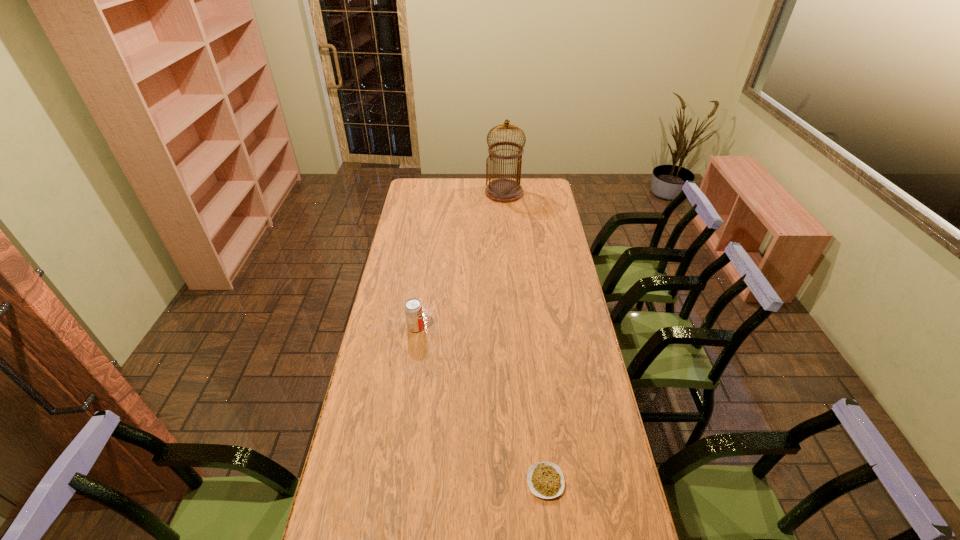
You are a GUI agent. You are given a task and a screenshot of the screen. Output one action in this format:
    pyautogui.click(x=<x>, y=<y>)
    Task: Click on the blank region between the tallest object and the shortest object
    
    Given the screenshot: What is the action you would take?
    pyautogui.click(x=525, y=337)

The width and height of the screenshot is (960, 540). Identify the location of vacant area between the nearest object and the farthest object. (525, 337).

This screenshot has width=960, height=540. In order to click on object that is the second closest to the farthest object in this screenshot , I will do `click(545, 479)`.

Identify which object is located as the nearest to the nearest object. Please provide its 2D coordinates. Your answer should be formatted as a tuple, i.e. [(x, y)], where the tuple contains the x and y coordinates of a point satisfying the conditions above.

[(413, 308)]

At what (x,y) coordinates should I click in order to perform the action: click on free space in the image that satisfies the following two spatial constraints: 1. on the front-facing side of the shortest object; 2. on the left side of the tallest object. Please return your answer as a coordinate pair (x, y). Looking at the image, I should click on (527, 482).

The height and width of the screenshot is (540, 960). What are the coordinates of `vacant area that satisfies the following two spatial constraints: 1. on the front-facing side of the shortest object; 2. on the left side of the birdcage` in the screenshot? It's located at (527, 482).

Where is `vacant space that satisfies the following two spatial constraints: 1. on the front-facing side of the nearest object; 2. on the left side of the birdcage`? The height and width of the screenshot is (540, 960). vacant space that satisfies the following two spatial constraints: 1. on the front-facing side of the nearest object; 2. on the left side of the birdcage is located at coordinates (527, 482).

Identify the location of free spot that satisfies the following two spatial constraints: 1. on the front side of the soda; 2. on the right side of the legume. This screenshot has height=540, width=960. (394, 482).